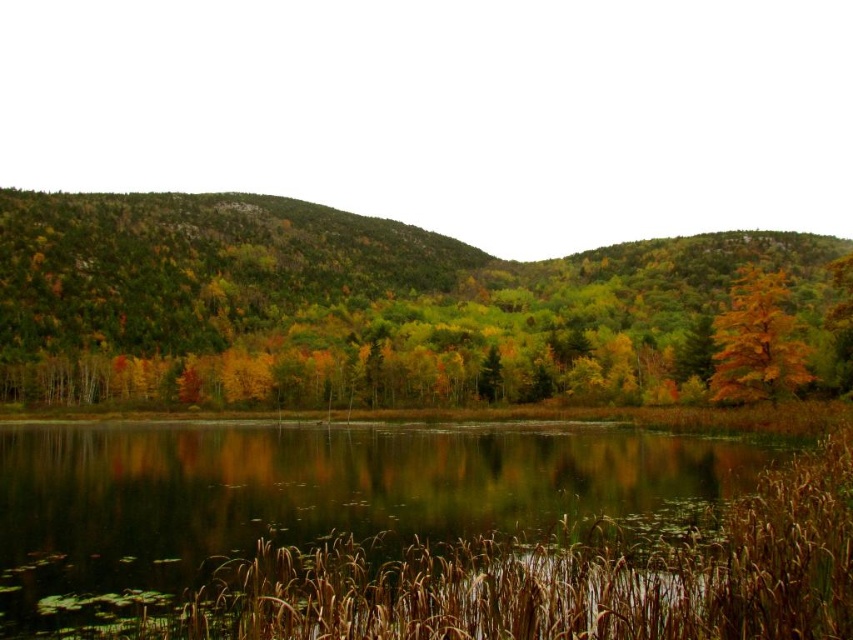
Question: Which of the following is the farthest from the observer?

Choices:
 (A) brown grass at lower center
 (B) yellow matte tree at right

Answer: (B)

Question: Can you confirm if brown grass at lower center is wider than yellow matte tree at right?

Choices:
 (A) yes
 (B) no

Answer: (B)

Question: Does yellow-green foliage at center come behind yellow matte tree at right?

Choices:
 (A) yes
 (B) no

Answer: (B)

Question: Is brown grass at lower center further to the viewer compared to yellow matte tree at right?

Choices:
 (A) yes
 (B) no

Answer: (B)

Question: Estimate the real-world distances between objects in this image. Which object is farther from the yellow matte tree at right?

Choices:
 (A) yellow-green foliage at center
 (B) brown grass at lower center

Answer: (A)

Question: Among these objects, which one is nearest to the camera?

Choices:
 (A) brown grass at lower center
 (B) yellow-green foliage at center

Answer: (A)